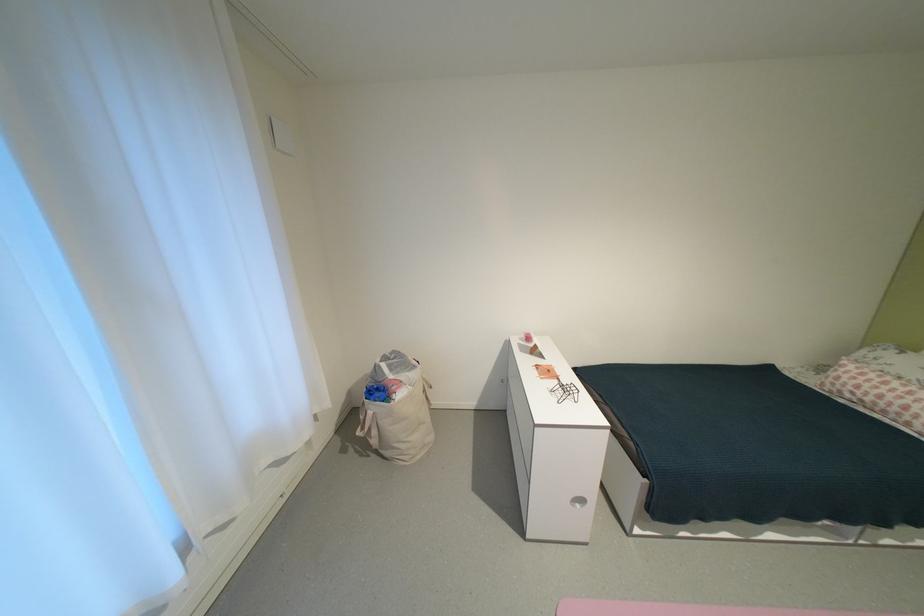
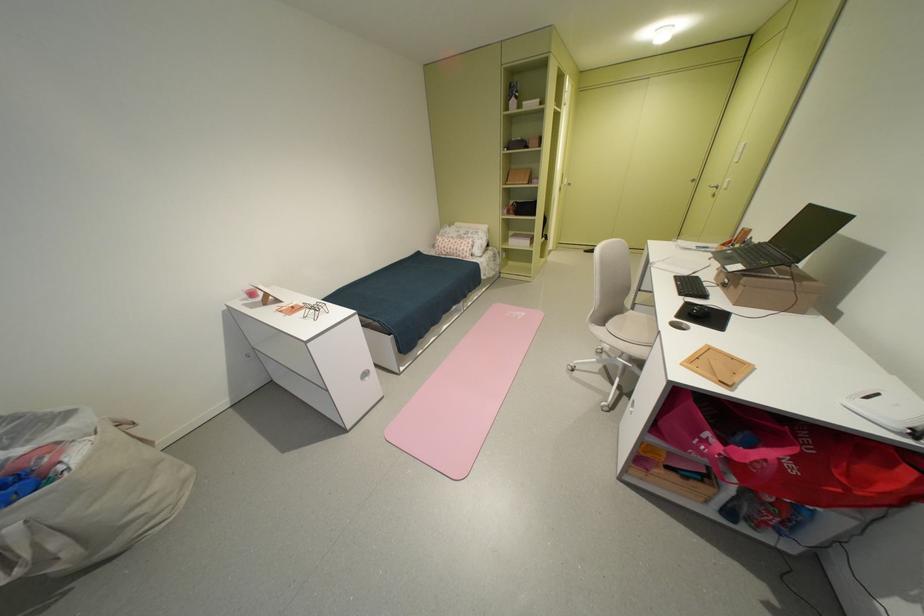
Find the pixel in the second image that matches the point at 395,377 in the first image.

(6, 463)